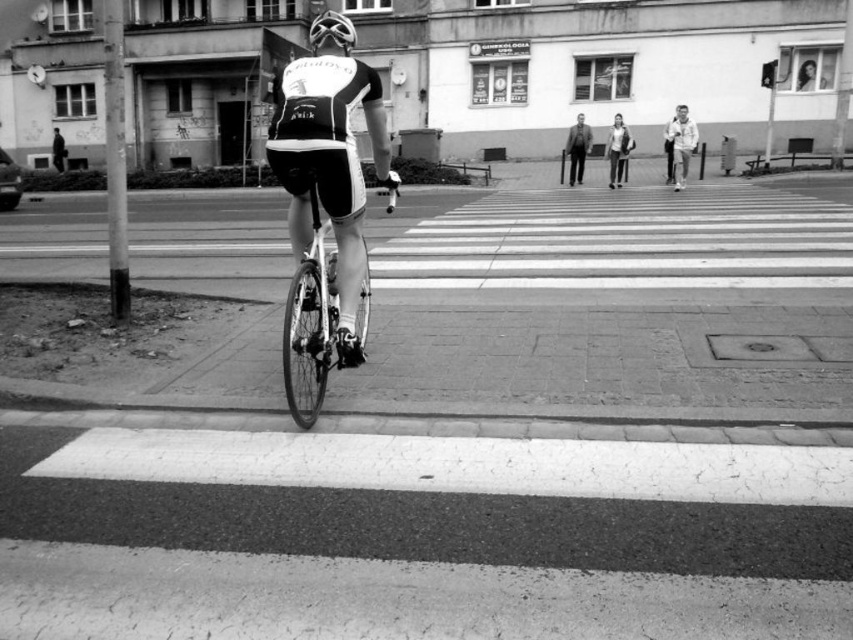
You are a photographer standing at the edge of the crosswalk. You want to take a photo that includes both the light brown leather jacket at center and the dark gray suit at center. Which object should you focus on first if you want to ensure both are in sharp focus?

The light brown leather jacket at center has a larger size compared to the dark gray suit at center, so you should focus on the light brown leather jacket at center first to ensure both are in sharp focus.

Based on the scene described, where is the shiny metallic bicycle at center located in terms of coordinates?

The shiny metallic bicycle at center is located at coordinates [311,321].

You are a fashion designer observing the urban street scene. You notice two individuals wearing the light gray fabric jacket at upper right and the dark gray suit at center. Which clothing item has a wider silhouette?

The light gray fabric jacket at upper right has a wider silhouette than the dark gray suit at center, as its width is larger.